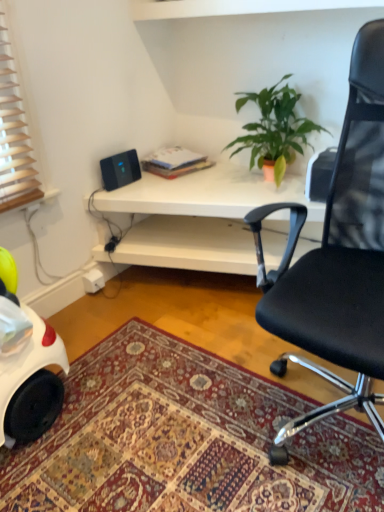
Question: Does carpeted rug at lower center have a larger size compared to white matte desk at center?

Choices:
 (A) no
 (B) yes

Answer: (A)

Question: Would you say carpeted rug at lower center is a long distance from white matte desk at center?

Choices:
 (A) yes
 (B) no

Answer: (B)

Question: Considering the relative sizes of carpeted rug at lower center and white matte desk at center in the image provided, is carpeted rug at lower center shorter than white matte desk at center?

Choices:
 (A) no
 (B) yes

Answer: (B)

Question: Does carpeted rug at lower center have a lesser width compared to white matte desk at center?

Choices:
 (A) no
 (B) yes

Answer: (A)

Question: Considering the relative positions of carpeted rug at lower center and white matte desk at center in the image provided, is carpeted rug at lower center in front of white matte desk at center?

Choices:
 (A) no
 (B) yes

Answer: (B)

Question: Is carpeted rug at lower center taller than white matte desk at center?

Choices:
 (A) no
 (B) yes

Answer: (A)

Question: Is green matte plant at upper center thinner than black plastic speaker at upper left?

Choices:
 (A) no
 (B) yes

Answer: (A)

Question: Considering the relative sizes of green matte plant at upper center and black plastic speaker at upper left in the image provided, is green matte plant at upper center shorter than black plastic speaker at upper left?

Choices:
 (A) yes
 (B) no

Answer: (B)

Question: Considering the relative positions of green matte plant at upper center and black plastic speaker at upper left in the image provided, is green matte plant at upper center behind black plastic speaker at upper left?

Choices:
 (A) yes
 (B) no

Answer: (B)

Question: Is green matte plant at upper center smaller than black plastic speaker at upper left?

Choices:
 (A) no
 (B) yes

Answer: (A)

Question: Considering the relative sizes of green matte plant at upper center and black plastic speaker at upper left in the image provided, is green matte plant at upper center wider than black plastic speaker at upper left?

Choices:
 (A) no
 (B) yes

Answer: (B)

Question: From the image's perspective, is green matte plant at upper center under black plastic speaker at upper left?

Choices:
 (A) no
 (B) yes

Answer: (A)

Question: Is black mesh office chair at upper right a part of black plastic speaker at upper left?

Choices:
 (A) no
 (B) yes

Answer: (A)